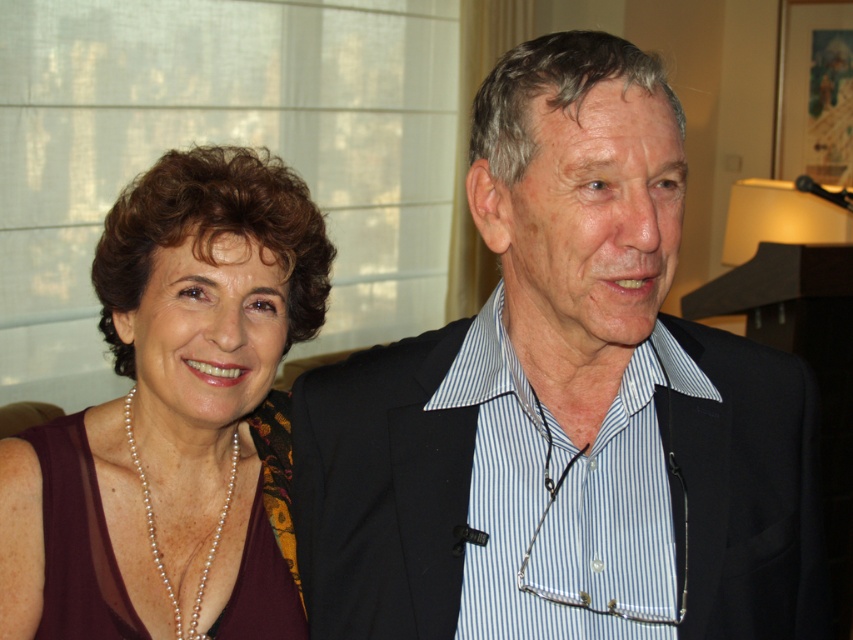
Between black striped shirt at center and maroon fabric dress at left, which one appears on the left side from the viewer's perspective?

Positioned to the left is maroon fabric dress at left.

The width and height of the screenshot is (853, 640). What do you see at coordinates (563, 404) in the screenshot?
I see `black striped shirt at center` at bounding box center [563, 404].

Where is `black striped shirt at center`? The width and height of the screenshot is (853, 640). black striped shirt at center is located at coordinates (563, 404).